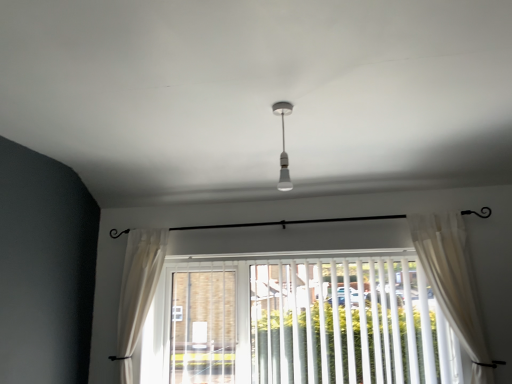
Question: Considering the positions of white sheer curtain at lower center, which ranks as the first curtain in back-to-front order, and white plastic blinds at center in the image, is white sheer curtain at lower center, which ranks as the first curtain in back-to-front order, wider or thinner than white plastic blinds at center?

Choices:
 (A) wide
 (B) thin

Answer: (A)

Question: From the image's perspective, is white sheer curtain at lower center, the 2th curtain in the right-to-left sequence, above or below white plastic blinds at center?

Choices:
 (A) below
 (B) above

Answer: (B)

Question: Which is farther from the white glossy bulb at center?

Choices:
 (A) white sheer curtain at lower center, arranged as the 2th curtain when viewed from the front
 (B) white plastic blinds at center
 (C) white sheer curtain at right, which ranks as the second curtain in left-to-right order

Answer: (A)

Question: Based on their relative distances, which object is farther from the white glossy bulb at center?

Choices:
 (A) white plastic blinds at center
 (B) white sheer curtain at lower center, which ranks as the first curtain in back-to-front order
 (C) white sheer curtain at right, which is the 1th curtain in right-to-left order

Answer: (B)